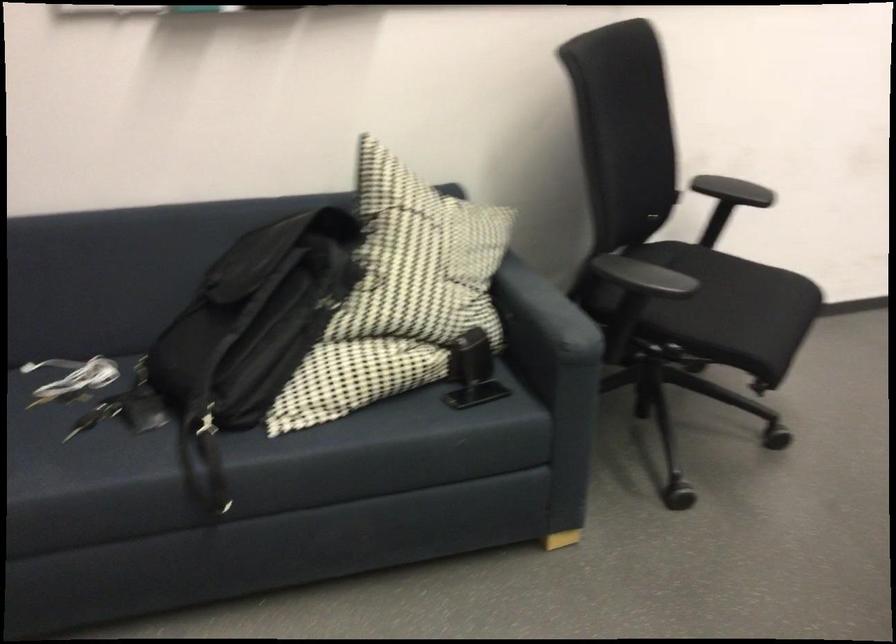
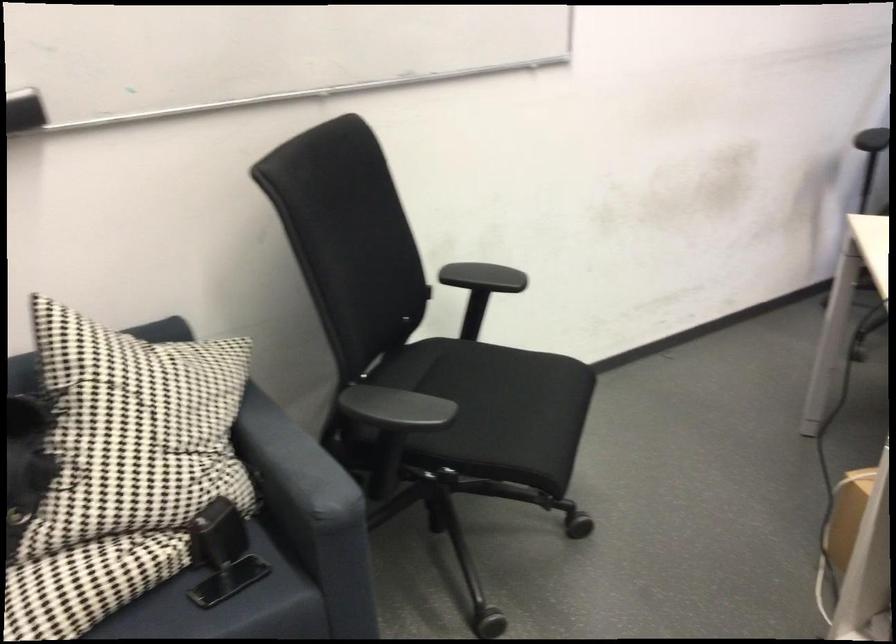
Find the pixel in the second image that matches (734,189) in the first image.

(483, 277)